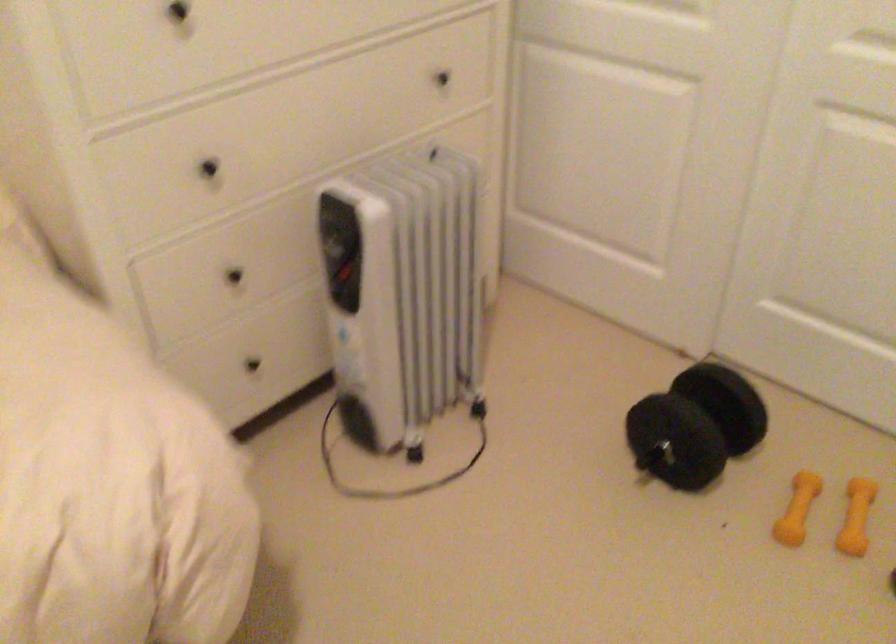
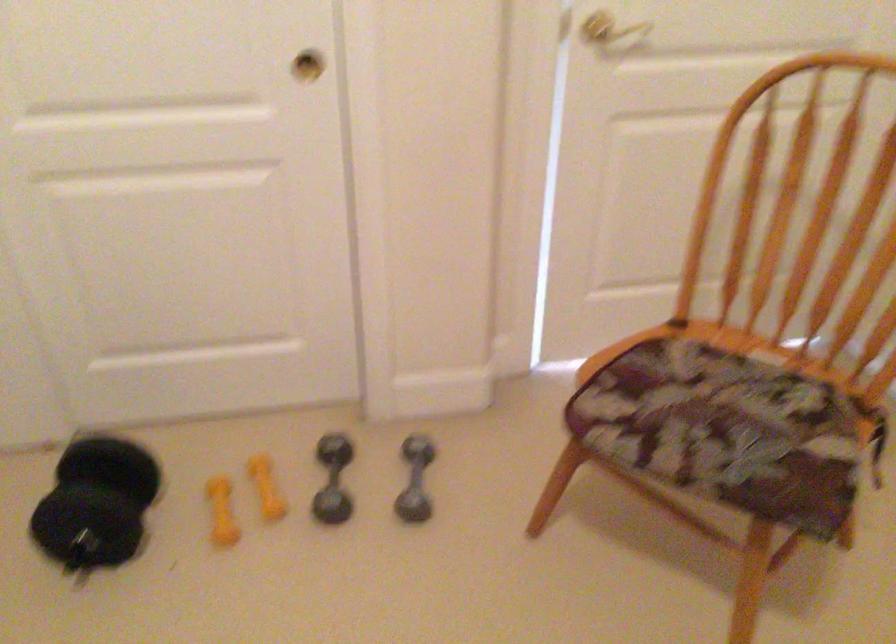
Question: The camera is either moving clockwise (left) or counter-clockwise (right) around the object. The first image is from the beginning of the video and the second image is from the end. Is the camera moving left or right when shooting the video?

Choices:
 (A) Left
 (B) Right

Answer: (A)